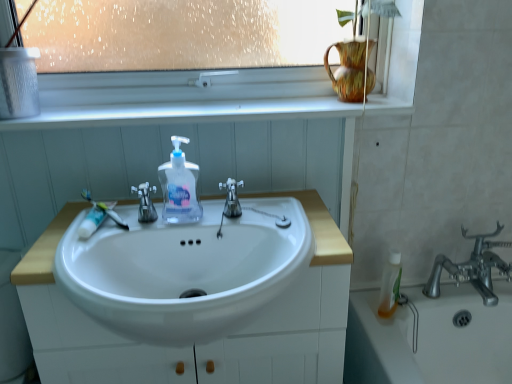
Question: Is translucent plastic mouthwash at lower right in front of or behind polished chrome faucet at center, the second tap positioned from the left, in the image?

Choices:
 (A) front
 (B) behind

Answer: (B)

Question: Considering the positions of translucent plastic mouthwash at lower right and polished chrome faucet at center, the first tap viewed from the right, in the image, is translucent plastic mouthwash at lower right wider or thinner than polished chrome faucet at center, the first tap viewed from the right,?

Choices:
 (A) wide
 (B) thin

Answer: (B)

Question: Based on their relative distances, which object is nearer to the translucent plastic mouthwash at lower right?

Choices:
 (A) white plastic window frame at upper center
 (B) satin nickel faucet at center, arranged as the second tap when viewed from the right
 (C) transparent plastic soap dispenser at center
 (D) white glossy window sill at upper center
 (E) white plastic toothbrush at left

Answer: (D)

Question: Estimate the real-world distances between objects in this image. Which object is closer to the translucent plastic mouthwash at lower right?

Choices:
 (A) transparent plastic soap dispenser at center
 (B) polished chrome faucet at center, the second tap positioned from the left
 (C) white glossy window sill at upper center
 (D) white plastic toothbrush at left
 (E) white plastic window frame at upper center

Answer: (B)